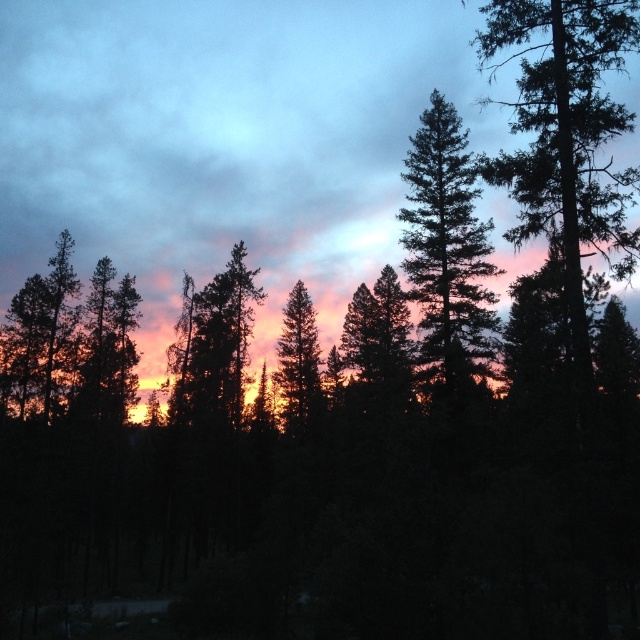
Question: Is green textured tree at upper right above green matte tree at center?

Choices:
 (A) yes
 (B) no

Answer: (A)

Question: Does green textured tree at upper right appear under silhouette pine tree at center?

Choices:
 (A) no
 (B) yes

Answer: (A)

Question: Which object is closer to the camera taking this photo?

Choices:
 (A) green textured pine tree at center
 (B) green textured tree at upper right
 (C) silhouette pine tree at center

Answer: (B)

Question: In this image, where is green textured tree at upper right located relative to green matte tree at center?

Choices:
 (A) above
 (B) below

Answer: (A)

Question: Estimate the real-world distances between objects in this image. Which object is closer to the green textured pine tree at center?

Choices:
 (A) silhouette pine tree at center
 (B) green textured tree at upper right

Answer: (B)

Question: Which point appears closest to the camera in this image?

Choices:
 (A) (529, 97)
 (B) (202, 312)
 (C) (305, 371)
 (D) (422, 321)

Answer: (A)